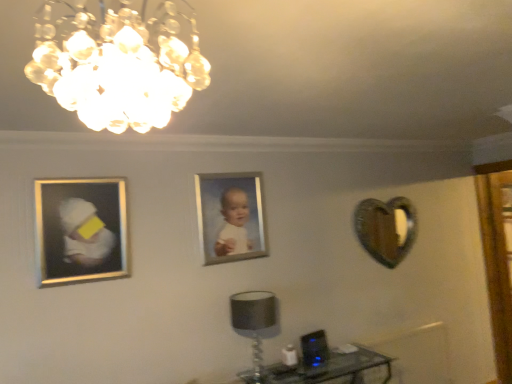
Question: Is transparent glass table at lower right wider than silver metallic picture frame at center, positioned as the 2th picture frame in left-to-right order?

Choices:
 (A) no
 (B) yes

Answer: (B)

Question: Is transparent glass table at lower right directly adjacent to silver metallic picture frame at center, the 2th picture frame viewed from the front?

Choices:
 (A) no
 (B) yes

Answer: (A)

Question: From a real-world perspective, is transparent glass table at lower right below silver metallic picture frame at center, positioned as the 2th picture frame in left-to-right order?

Choices:
 (A) no
 (B) yes

Answer: (B)

Question: Is transparent glass table at lower right bigger than silver metallic picture frame at center, the 1th picture frame viewed from the right?

Choices:
 (A) no
 (B) yes

Answer: (B)

Question: Is silver metallic picture frame at center, the 1th picture frame viewed from the right, inside transparent glass table at lower right?

Choices:
 (A) no
 (B) yes

Answer: (A)

Question: Would you say transparent glass table at lower right is outside silver metallic picture frame at center, the 2th picture frame viewed from the front?

Choices:
 (A) no
 (B) yes

Answer: (B)

Question: Is metallic heart-shaped mirror at right further to the viewer compared to silver/metallic picture frame at left, acting as the second picture frame starting from the right?

Choices:
 (A) no
 (B) yes

Answer: (B)

Question: From a real-world perspective, is metallic heart-shaped mirror at right beneath silver/metallic picture frame at left, which is counted as the first picture frame, starting from the front?

Choices:
 (A) yes
 (B) no

Answer: (A)

Question: Is there a large distance between metallic heart-shaped mirror at right and silver/metallic picture frame at left, marked as the 2th picture frame in a back-to-front arrangement?

Choices:
 (A) no
 (B) yes

Answer: (B)

Question: From the image's perspective, is metallic heart-shaped mirror at right below silver/metallic picture frame at left, which is counted as the first picture frame, starting from the left?

Choices:
 (A) no
 (B) yes

Answer: (B)

Question: Can you confirm if metallic heart-shaped mirror at right is taller than silver/metallic picture frame at left, which is counted as the first picture frame, starting from the front?

Choices:
 (A) no
 (B) yes

Answer: (A)

Question: Is metallic heart-shaped mirror at right positioned with its back to silver/metallic picture frame at left, marked as the 2th picture frame in a back-to-front arrangement?

Choices:
 (A) no
 (B) yes

Answer: (A)

Question: Can you confirm if silver metallic picture frame at center, the 1th picture frame viewed from the right, is wider than silver/metallic picture frame at left, which is counted as the first picture frame, starting from the left?

Choices:
 (A) no
 (B) yes

Answer: (A)